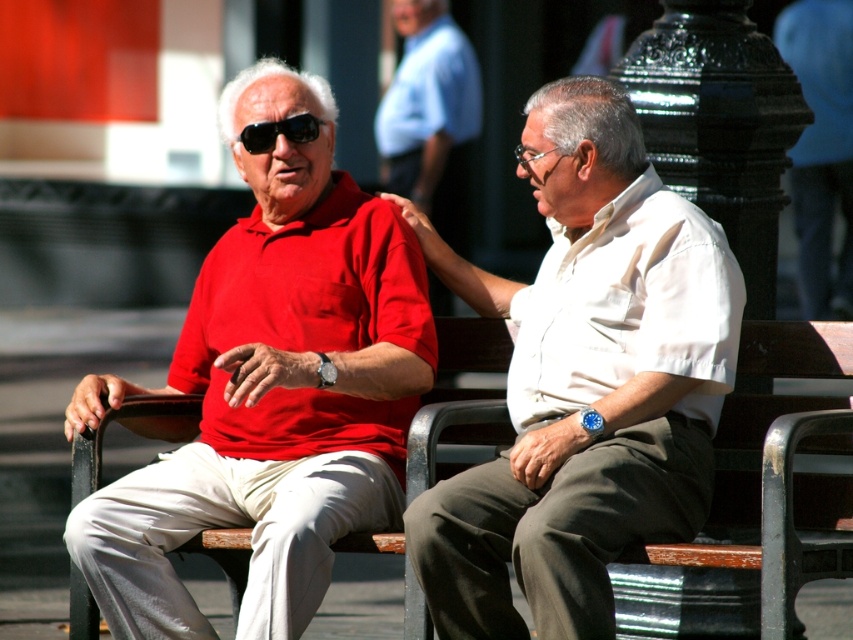
You are a photographer trying to capture the man in the white short sleeved shirt at center. The camera you are using has a focus point at coordinate point [584,381]. Will the focus point land on the white matte shirt at center?

Yes, the focus point at coordinate point [584,381] will land on the white matte shirt at center because the description states that the white matte shirt at center is located at that exact coordinate.

You are a delivery person who needs to place a small package on the bench between the two men. The package requires at least 4 feet of space to be placed safely. Can you fit the package between the matte red polo shirt at left and the brown wooden bench at center?

The matte red polo shirt at left is 5.46 feet away from the brown wooden bench at center. Since the required space is 4 feet, the package can be safely placed between them as there is enough space.